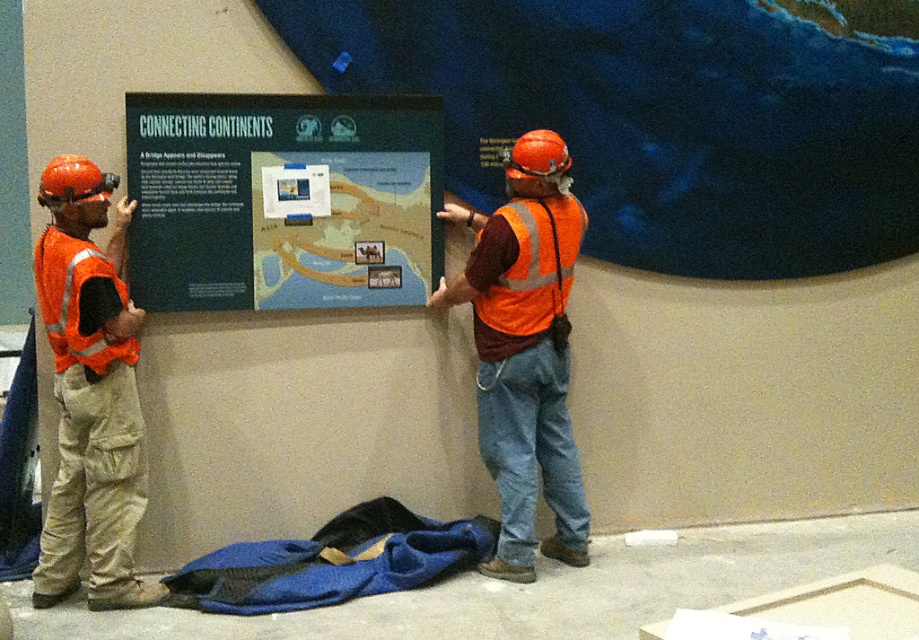
You are a safety inspector observing the scene. You notice two workers wearing orange safety vests. The reflective orange vest at center and the matte orange safety vest at left. Which worker is standing to the right of the other?

The reflective orange vest at center is positioned on the right side of matte orange safety vest at left, so the worker wearing the reflective orange vest at center is standing to the right of the worker in the matte orange safety vest at left.

You are a construction worker standing at the origin point in the scene. The green matte signboard at center is located at coordinates given. Can you reach the signboard without moving your feet?

The green matte signboard at center is located at coordinates point (x=282, y=200), so yes, you can reach it without moving your feet as it is within your arm reach.